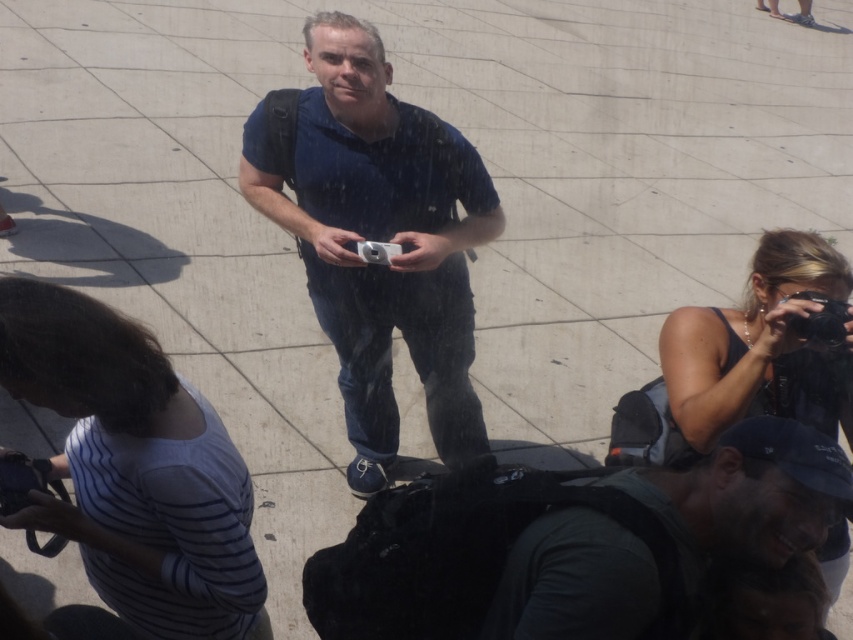
You are a photographer who wants to choose between the black rubber camera at upper right and the silver metallic camera at center. Which camera is bigger?

The black rubber camera at upper right is larger in size than the silver metallic camera at center.

You are standing in the plaza and want to walk from point [322,132] to point [254,609]. Which direction should you face to walk towards your destination?

You should face towards the right direction since point [254,609] is further away from the viewer compared to point [322,132].